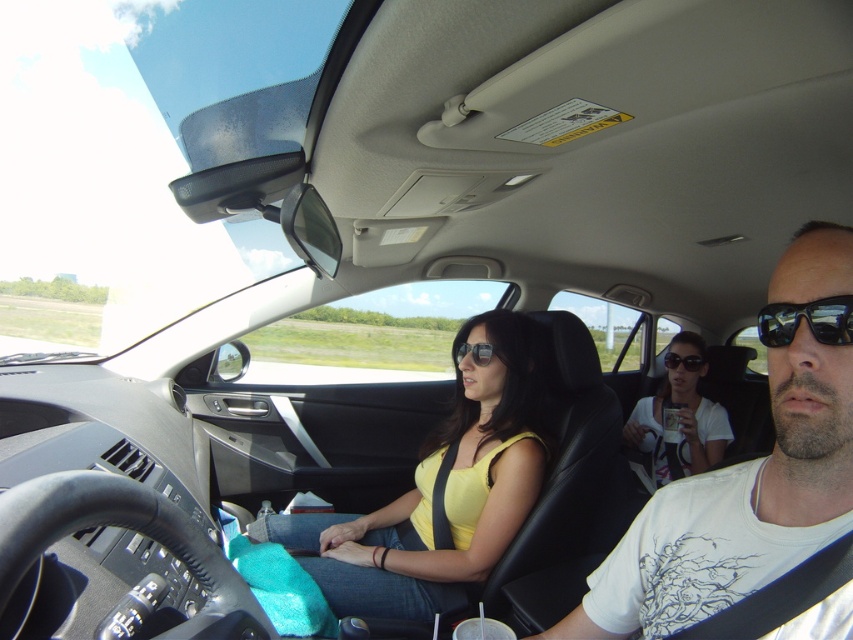
You are a passenger in the car and want to place both a white matte cup at center and black plastic goggles at center on the center console. Which object should you place first to ensure both fit without overlapping?

Since the white matte cup at center is wider than the black plastic goggles at center, you should place the white matte cup at center first to ensure there is enough space for both objects on the center console.